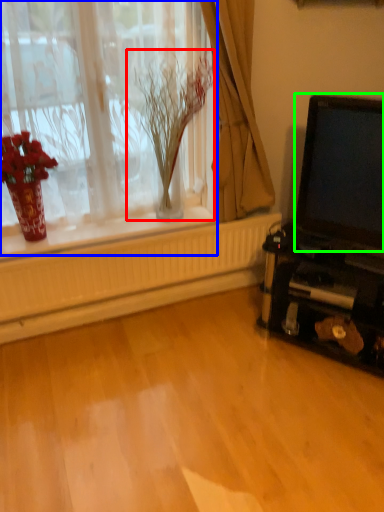
Question: Which is farther away from plant (highlighted by a red box)? window (highlighted by a blue box) or laptop (highlighted by a green box)?

Choices:
 (A) window
 (B) laptop

Answer: (B)